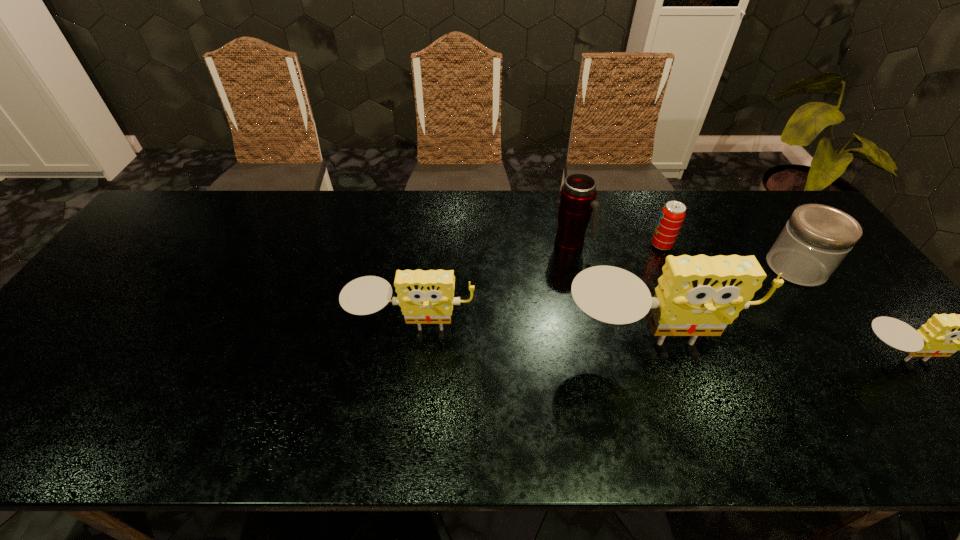
Where is `free space between the thermos bottle and the soda can`? free space between the thermos bottle and the soda can is located at coordinates click(x=616, y=245).

The width and height of the screenshot is (960, 540). Find the location of `blank region between the soda can and the thermos bottle`. blank region between the soda can and the thermos bottle is located at coordinates (616, 245).

This screenshot has height=540, width=960. Find the location of `vacant space that is in between the leftmost sponge and the second sponge from right to left`. vacant space that is in between the leftmost sponge and the second sponge from right to left is located at coordinates (531, 339).

Locate an element on the screen. This screenshot has width=960, height=540. free space between the leftmost sponge and the soda can is located at coordinates (538, 288).

Select which object is the third closest to the rightmost sponge. Please provide its 2D coordinates. Your answer should be formatted as a tuple, i.e. [(x, y)], where the tuple contains the x and y coordinates of a point satisfying the conditions above.

[(671, 218)]

Where is `object that is the second closest to the jar`? The image size is (960, 540). object that is the second closest to the jar is located at coordinates (699, 295).

Locate an element on the screen. The image size is (960, 540). sponge that is the nearest to the thermos bottle is located at coordinates (699, 295).

Select which sponge appears as the closest to the shortest sponge. Please provide its 2D coordinates. Your answer should be formatted as a tuple, i.e. [(x, y)], where the tuple contains the x and y coordinates of a point satisfying the conditions above.

[(699, 295)]

Where is `vacant space that satisfies the following two spatial constraints: 1. on the side with the handle of the thermos bottle; 2. on the front-facing side of the leftmost object`? vacant space that satisfies the following two spatial constraints: 1. on the side with the handle of the thermos bottle; 2. on the front-facing side of the leftmost object is located at coordinates (589, 332).